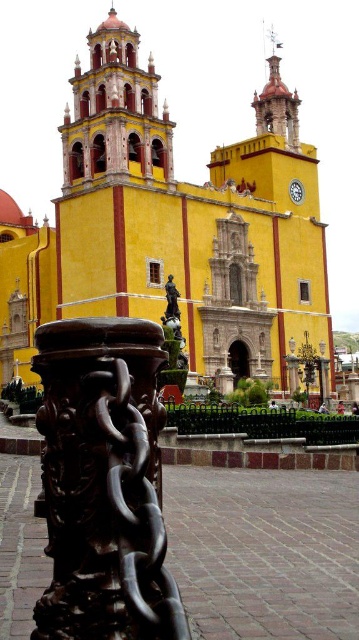
Question: Is polished dark brown pillar at center above matte yellow tower at upper left?

Choices:
 (A) yes
 (B) no

Answer: (B)

Question: Which point appears farthest from the camera in this image?

Choices:
 (A) (105, 588)
 (B) (126, 70)
 (C) (95, 244)

Answer: (B)

Question: Does yellow stone church at center appear on the right side of polished dark brown pillar at center?

Choices:
 (A) no
 (B) yes

Answer: (B)

Question: Based on their relative distances, which object is farther from the matte yellow tower at upper left?

Choices:
 (A) yellow stone church at center
 (B) polished dark brown pillar at center

Answer: (B)

Question: Which of the following is the closest to the observer?

Choices:
 (A) yellow stone church at center
 (B) matte yellow tower at upper left
 (C) polished dark brown pillar at center

Answer: (C)

Question: Is polished dark brown pillar at center below matte yellow tower at upper left?

Choices:
 (A) no
 (B) yes

Answer: (B)